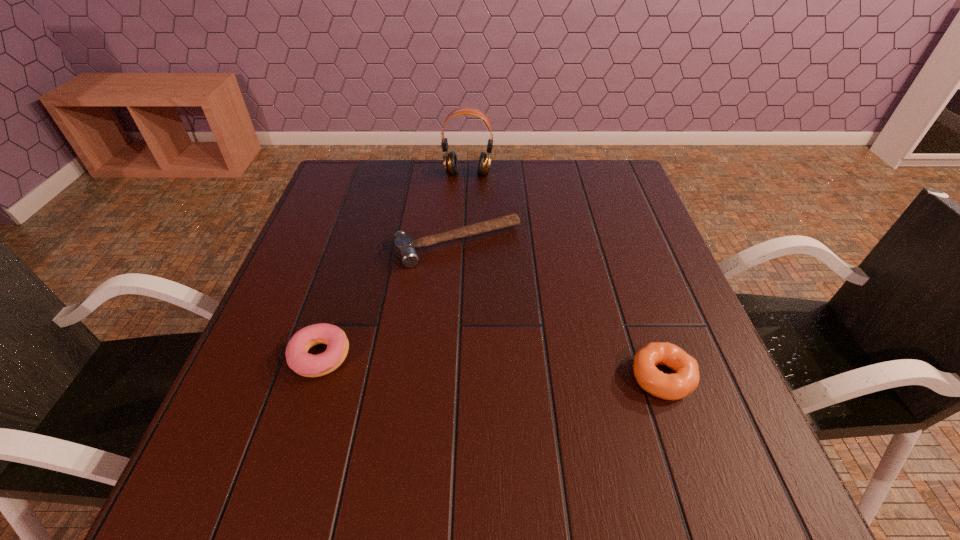
I want to click on vacant space on the desktop that is between the left doughnut and the rightmost object and is positioned on the striking face of the hammer, so click(x=530, y=369).

Image resolution: width=960 pixels, height=540 pixels. Identify the location of vacant spot on the desktop that is between the leftmost object and the right doughnut and is positioned on the ear cups of the tallest object. click(443, 364).